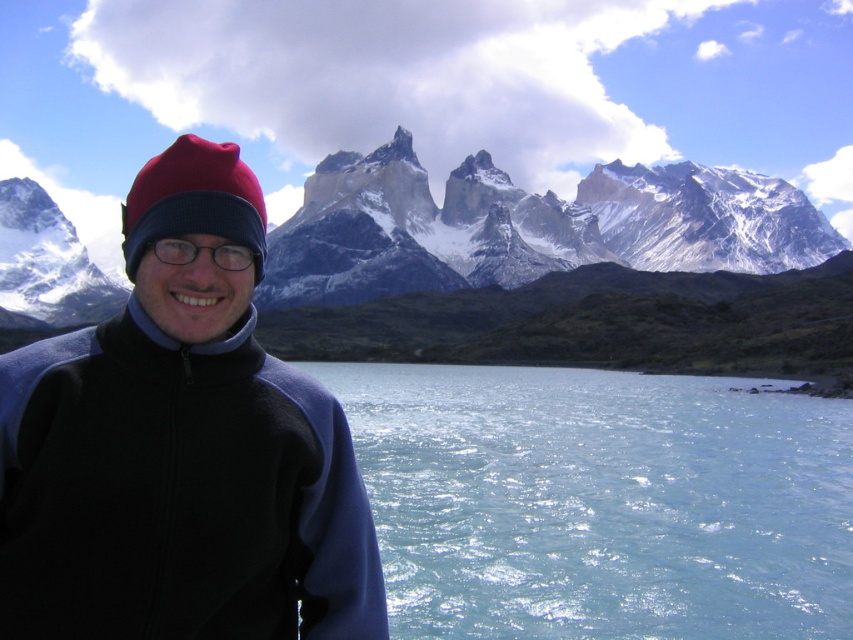
Question: Is matte fleece jacket at center to the left of snowy granite mountain range at upper center from the viewer's perspective?

Choices:
 (A) yes
 (B) no

Answer: (A)

Question: Which of the following is the closest to the observer?

Choices:
 (A) clear water at lower center
 (B) matte fleece jacket at center
 (C) snowy granite mountain range at upper center
 (D) red woolen beanie at left

Answer: (B)

Question: Estimate the real-world distances between objects in this image. Which object is farther from the clear water at lower center?

Choices:
 (A) matte fleece jacket at center
 (B) red woolen beanie at left

Answer: (B)

Question: Which point is farther from the camera taking this photo?

Choices:
 (A) (222, 205)
 (B) (494, 582)

Answer: (B)

Question: Is matte fleece jacket at center to the left of clear water at lower center from the viewer's perspective?

Choices:
 (A) yes
 (B) no

Answer: (A)

Question: Does matte fleece jacket at center appear over clear water at lower center?

Choices:
 (A) no
 (B) yes

Answer: (B)